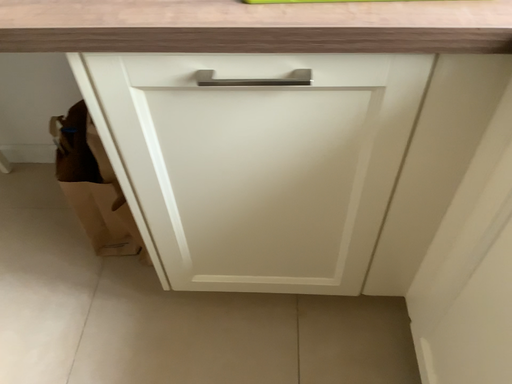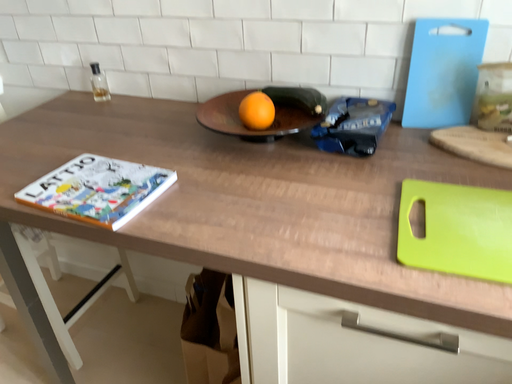
Question: How did the camera likely rotate when shooting the video?

Choices:
 (A) rotated right
 (B) rotated left

Answer: (B)